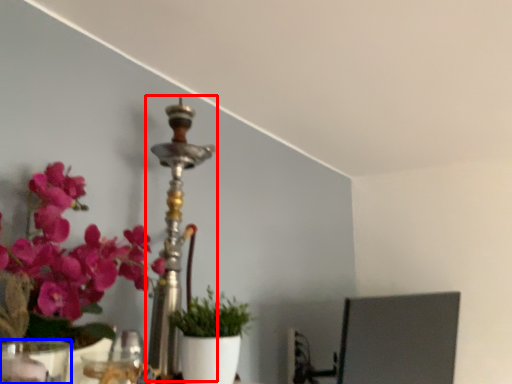
Question: Which object appears farthest to the camera in this image, candle holder (highlighted by a red box) or vase (highlighted by a blue box)?

Choices:
 (A) candle holder
 (B) vase

Answer: (A)